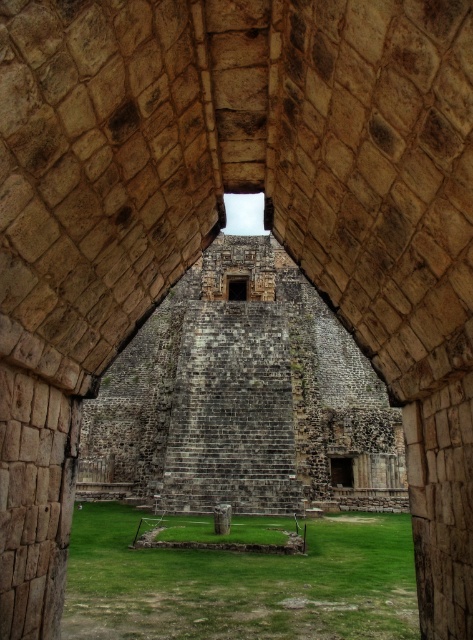
Question: Does dark stone window at center appear on the left side of transparent glass window at center?

Choices:
 (A) no
 (B) yes

Answer: (A)

Question: Which point is farther to the camera?

Choices:
 (A) (231, 280)
 (B) (365, 522)
 (C) (346, 481)

Answer: (A)

Question: Can you confirm if green grass at center is positioned to the left of dark stone window at center?

Choices:
 (A) yes
 (B) no

Answer: (A)

Question: Which point appears closest to the camera in this image?

Choices:
 (A) 286,518
 (B) 243,292
 (C) 332,465

Answer: (A)

Question: Which point is closer to the camera?

Choices:
 (A) (236, 288)
 (B) (341, 461)

Answer: (B)

Question: Does green grass at center appear over transparent glass window at center?

Choices:
 (A) yes
 (B) no

Answer: (B)